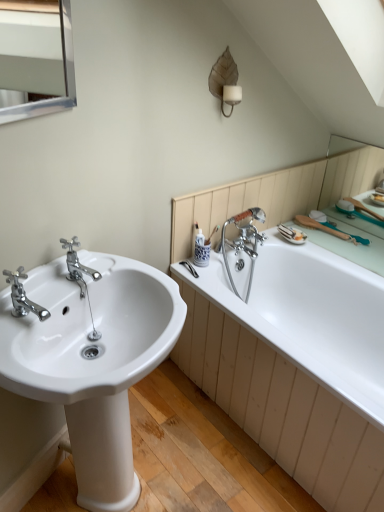
The image size is (384, 512). Describe the element at coordinates (23, 296) in the screenshot. I see `chrome metallic faucet at left, marked as the first tap in a front-to-back arrangement` at that location.

Describe the element at coordinates (37, 57) in the screenshot. This screenshot has width=384, height=512. I see `silver metallic medicine cabinet at upper left` at that location.

Image resolution: width=384 pixels, height=512 pixels. Find the location of `chrome metallic faucet at left, positioned as the first tap in back-to-front order`. chrome metallic faucet at left, positioned as the first tap in back-to-front order is located at coordinates (77, 265).

At what (x,y) coordinates should I click in order to perform the action: click on white glossy bathtub at right. Please return your answer as a coordinate pair (x, y). Looking at the image, I should click on tap(311, 316).

Describe the element at coordinates (311, 316) in the screenshot. I see `white glossy bathtub at right` at that location.

Locate an element on the screen. chrome metallic faucet at left, marked as the first tap in a front-to-back arrangement is located at coordinates (23, 296).

The width and height of the screenshot is (384, 512). In order to click on medicine cabinet above the white glossy bathtub at right (from a real-world perspective) in this screenshot , I will do `click(37, 57)`.

Considering the relative sizes of white glossy bathtub at right and silver metallic medicine cabinet at upper left in the image provided, is white glossy bathtub at right bigger than silver metallic medicine cabinet at upper left?

Yes.

From the image's perspective, which one is positioned lower, white glossy bathtub at right or silver metallic medicine cabinet at upper left?

white glossy bathtub at right appears lower in the image.

Does point (78, 385) appear closer or farther from the camera than point (21, 285)?

Point (78, 385) is positioned closer to the camera compared to point (21, 285).

From a real-world perspective, is white glossy sink at left positioned over chrome metallic faucet at left, marked as the first tap in a front-to-back arrangement, based on gravity?

No.

Can you confirm if white glossy sink at left is bigger than chrome metallic faucet at left, marked as the first tap in a front-to-back arrangement?

Indeed, white glossy sink at left has a larger size compared to chrome metallic faucet at left, marked as the first tap in a front-to-back arrangement.

Which of these two, matte brown leaf-shaped sconce at upper center or silver metallic medicine cabinet at upper left, is smaller?

With smaller size is silver metallic medicine cabinet at upper left.

From the image's perspective, between matte brown leaf-shaped sconce at upper center and silver metallic medicine cabinet at upper left, who is located below?

silver metallic medicine cabinet at upper left.

Is matte brown leaf-shaped sconce at upper center turned away from silver metallic medicine cabinet at upper left?

matte brown leaf-shaped sconce at upper center does not have its back to silver metallic medicine cabinet at upper left.

Considering the sizes of objects matte brown leaf-shaped sconce at upper center and silver metallic medicine cabinet at upper left in the image provided, who is thinner, matte brown leaf-shaped sconce at upper center or silver metallic medicine cabinet at upper left?

With smaller width is silver metallic medicine cabinet at upper left.

How far apart are chrome metallic faucet at left, which appears as the 2th tap when viewed from the back, and silver metallic medicine cabinet at upper left?

1.51 meters.

From the image's perspective, who appears lower, chrome metallic faucet at left, marked as the first tap in a front-to-back arrangement, or silver metallic medicine cabinet at upper left?

chrome metallic faucet at left, marked as the first tap in a front-to-back arrangement, appears lower in the image.

Is chrome metallic faucet at left, which appears as the 2th tap when viewed from the back, in front of or behind silver metallic medicine cabinet at upper left in the image?

Clearly, chrome metallic faucet at left, which appears as the 2th tap when viewed from the back, is behind silver metallic medicine cabinet at upper left.

From a real-world perspective, count 2nd taps downward from the silver metallic medicine cabinet at upper left and point to it. Please provide its 2D coordinates.

[(23, 296)]

From the image's perspective, is white glossy sink at left located above or below silver metallic medicine cabinet at upper left?

white glossy sink at left is below silver metallic medicine cabinet at upper left.

Visually, is white glossy sink at left positioned to the left or to the right of silver metallic medicine cabinet at upper left?

Clearly, white glossy sink at left is on the right of silver metallic medicine cabinet at upper left in the image.

Between white glossy sink at left and silver metallic medicine cabinet at upper left, which one is positioned behind?

silver metallic medicine cabinet at upper left is further from the camera.

Between chrome metallic faucet at left, positioned as the 2th tap in front-to-back order, and matte brown leaf-shaped sconce at upper center, which one has smaller width?

matte brown leaf-shaped sconce at upper center.

Could you tell me if chrome metallic faucet at left, positioned as the 2th tap in front-to-back order, is facing matte brown leaf-shaped sconce at upper center?

No, chrome metallic faucet at left, positioned as the 2th tap in front-to-back order, is not aimed at matte brown leaf-shaped sconce at upper center.

Identify the location of the 1st tap below the matte brown leaf-shaped sconce at upper center (from the image's perspective). This screenshot has height=512, width=384. (77, 265).

What's the angular difference between chrome metallic faucet at left, positioned as the first tap in back-to-front order, and matte brown leaf-shaped sconce at upper center's facing directions?

The facing directions of chrome metallic faucet at left, positioned as the first tap in back-to-front order, and matte brown leaf-shaped sconce at upper center are 20.3 degrees apart.

Can you confirm if white glossy sink at left is positioned to the left of chrome metallic faucet at left, positioned as the first tap in back-to-front order?

No, white glossy sink at left is not to the left of chrome metallic faucet at left, positioned as the first tap in back-to-front order.

Considering the positions of point (119, 447) and point (67, 243), is point (119, 447) closer or farther from the camera than point (67, 243)?

Point (119, 447) is positioned farther from the camera compared to point (67, 243).

Where is `medicine cabinet located in front of the white glossy bathtub at right`? The image size is (384, 512). medicine cabinet located in front of the white glossy bathtub at right is located at coordinates (37, 57).

From the image's perspective, count 1st taps upward from the white glossy sink at left and point to it. Please provide its 2D coordinates.

[(23, 296)]

When comparing their distances from chrome metallic faucet at left, positioned as the 2th tap in front-to-back order, does white glossy bathtub at right or silver metallic medicine cabinet at upper left seem closer?

Among the two, white glossy bathtub at right is located nearer to chrome metallic faucet at left, positioned as the 2th tap in front-to-back order.

From the image, which object appears to be farther from chrome metallic faucet at left, marked as the first tap in a front-to-back arrangement, silver metallic medicine cabinet at upper left or chrome metallic faucet at left, positioned as the first tap in back-to-front order?

silver metallic medicine cabinet at upper left is positioned further to the anchor chrome metallic faucet at left, marked as the first tap in a front-to-back arrangement.

Considering their positions, is chrome metallic faucet at left, positioned as the first tap in back-to-front order, positioned further to silver metallic medicine cabinet at upper left than white glossy bathtub at right?

Among the two, white glossy bathtub at right is located further to silver metallic medicine cabinet at upper left.

Based on their spatial positions, is white glossy bathtub at right or chrome metallic faucet at left, positioned as the 2th tap in front-to-back order, closer to white glossy sink at left?

chrome metallic faucet at left, positioned as the 2th tap in front-to-back order, is positioned closer to the anchor white glossy sink at left.

Considering their positions, is chrome metallic faucet at left, which appears as the 2th tap when viewed from the back, positioned further to white glossy sink at left than matte brown leaf-shaped sconce at upper center?

matte brown leaf-shaped sconce at upper center is positioned further to the anchor white glossy sink at left.

Estimate the real-world distances between objects in this image. Which object is closer to white glossy bathtub at right, chrome metallic faucet at left, positioned as the first tap in back-to-front order, or chrome metallic faucet at left, marked as the first tap in a front-to-back arrangement?

The object closer to white glossy bathtub at right is chrome metallic faucet at left, positioned as the first tap in back-to-front order.

From the picture: When comparing their distances from silver metallic medicine cabinet at upper left, does white glossy sink at left or white glossy bathtub at right seem further?

white glossy sink at left.

Looking at the image, which one is located closer to matte brown leaf-shaped sconce at upper center, white glossy bathtub at right or chrome metallic faucet at left, which appears as the 2th tap when viewed from the back?

white glossy bathtub at right is positioned closer to the anchor matte brown leaf-shaped sconce at upper center.

Locate an element on the screen. The height and width of the screenshot is (512, 384). sink between chrome metallic faucet at left, positioned as the 2th tap in front-to-back order, and white glossy bathtub at right, in the horizontal direction is located at coordinates (92, 360).

Image resolution: width=384 pixels, height=512 pixels. I want to click on bathtub between silver metallic medicine cabinet at upper left and white glossy sink at left in the vertical direction, so click(x=311, y=316).

This screenshot has height=512, width=384. What are the coordinates of `medicine cabinet between matte brown leaf-shaped sconce at upper center and white glossy bathtub at right vertically` in the screenshot? It's located at (37, 57).

At what (x,y) coordinates should I click in order to perform the action: click on tap between chrome metallic faucet at left, which appears as the 2th tap when viewed from the back, and white glossy bathtub at right. Please return your answer as a coordinate pair (x, y). Looking at the image, I should click on (77, 265).